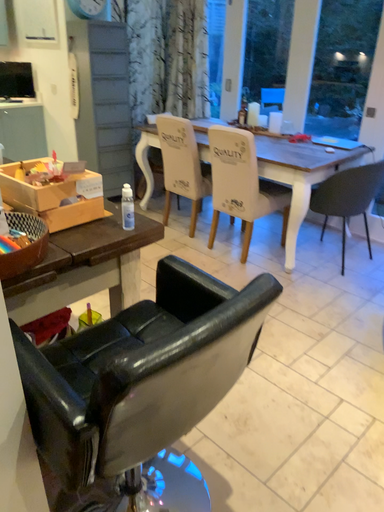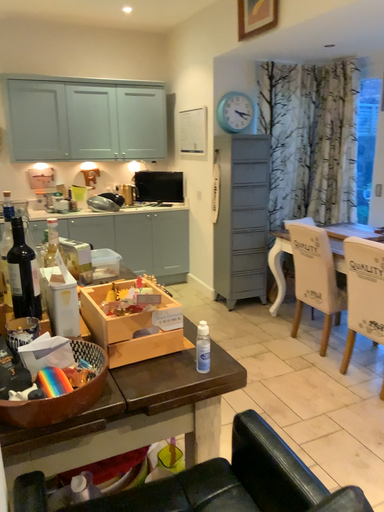
Question: How did the camera likely rotate when shooting the video?

Choices:
 (A) rotated downward
 (B) rotated upward

Answer: (B)